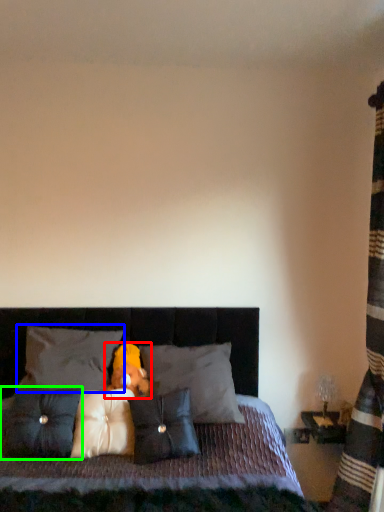
Question: Considering the real-world distances, which object is closest to teddy bear (highlighted by a red box)? pillow (highlighted by a blue box) or pillow (highlighted by a green box).

Choices:
 (A) pillow
 (B) pillow

Answer: (A)